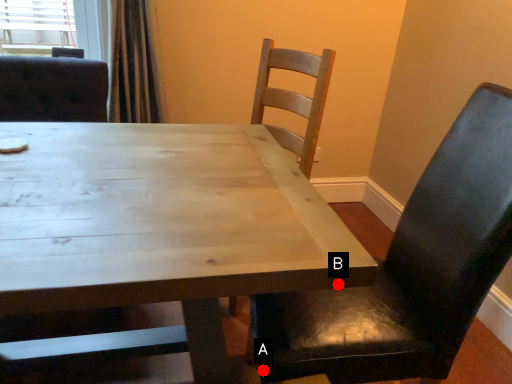
Question: Two points are circled on the image, labeled by A and B beside each circle. Which of the following is the closest to the observer?

Choices:
 (A) A is closer
 (B) B is closer

Answer: (B)